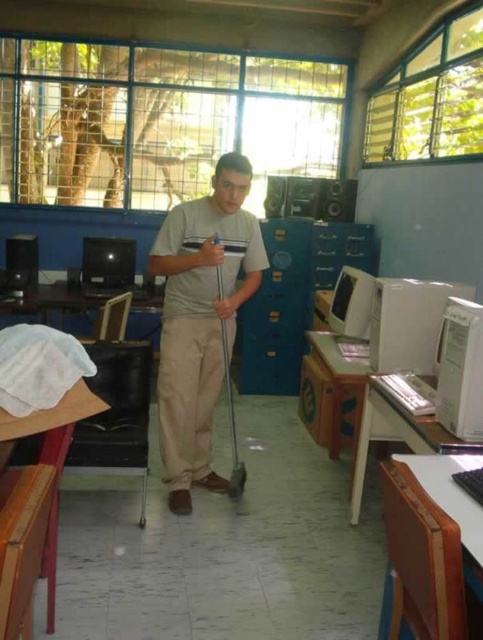
Between matte black speaker at left and metallic silver shovel at center, which one appears on the right side from the viewer's perspective?

Positioned to the right is metallic silver shovel at center.

Between point (28, 266) and point (232, 445), which one is positioned behind?

The point (28, 266) is more distant.

Is point (12, 262) more distant than point (233, 483)?

Yes, point (12, 262) is behind point (233, 483).

You are a GUI agent. You are given a task and a screenshot of the screen. Output one action in this format:
    pyautogui.click(x=<x>, y=<y>)
    Task: Click on the matte black speaker at left
    This screenshot has width=483, height=640.
    Given the screenshot: What is the action you would take?
    pyautogui.click(x=22, y=262)

Is white plastic computer tower at right closer to the viewer compared to shiny black monitor at center?

Yes, white plastic computer tower at right is in front of shiny black monitor at center.

Which is behind, point (467, 300) or point (86, 253)?

The point (86, 253) is more distant.

Between point (440, 376) and point (128, 262), which one is positioned behind?

The point (128, 262) is more distant.

Where is `white plastic computer tower at right`? This screenshot has width=483, height=640. white plastic computer tower at right is located at coordinates (460, 369).

Which is in front, point (223, 484) or point (470, 339)?

Point (470, 339) is in front.

Does beige cotton pants at center appear over white plastic computer tower at right?

Indeed, beige cotton pants at center is positioned over white plastic computer tower at right.

Is point (207, 465) closer to viewer compared to point (481, 346)?

No, it is not.

Find the location of a particular element. This screenshot has height=640, width=483. beige cotton pants at center is located at coordinates (200, 317).